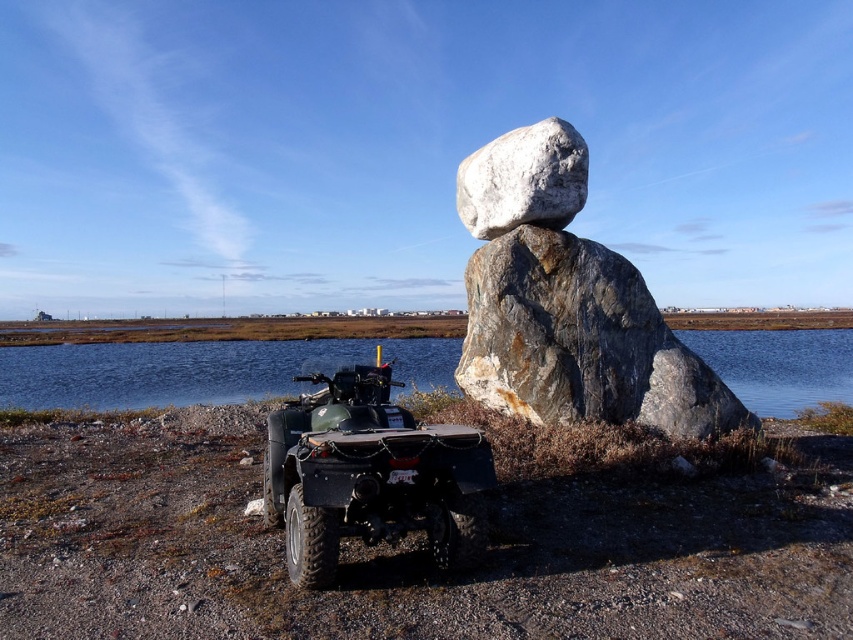
Question: Is matte black quad bike at lower center behind blue water at center?

Choices:
 (A) no
 (B) yes

Answer: (A)

Question: Can you confirm if blue water at center is positioned to the right of white smooth rock at center?

Choices:
 (A) no
 (B) yes

Answer: (B)

Question: Which of the following is the farthest from the observer?

Choices:
 (A) blue water at center
 (B) matte black quad bike at lower center

Answer: (A)

Question: Estimate the real-world distances between objects in this image. Which object is farther from the matte black quad bike at lower center?

Choices:
 (A) white smooth rock at center
 (B) blue water at center

Answer: (B)

Question: Estimate the real-world distances between objects in this image. Which object is farther from the blue water at center?

Choices:
 (A) white smooth rock at center
 (B) matte black quad bike at lower center

Answer: (B)

Question: In this image, where is matte black quad bike at lower center located relative to blue water at center?

Choices:
 (A) right
 (B) left

Answer: (B)